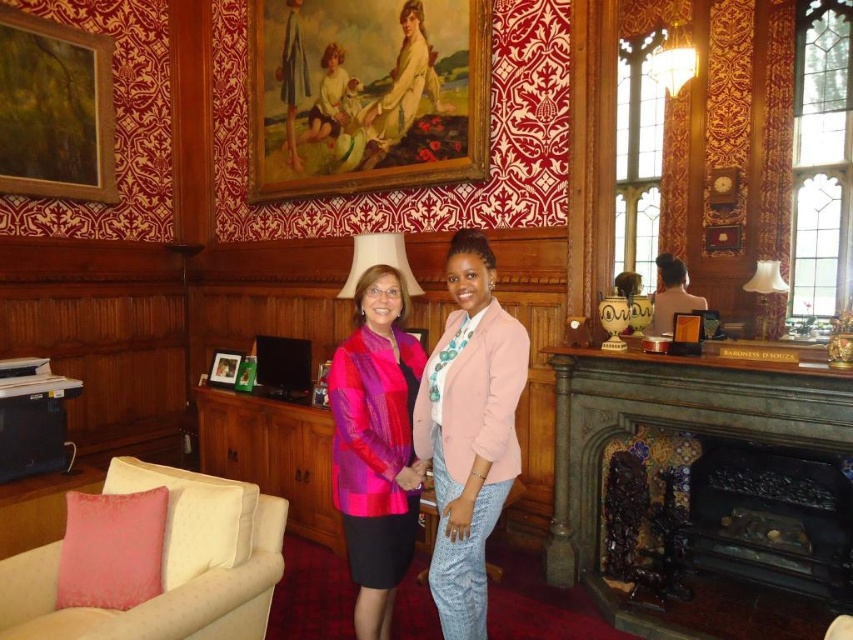
Question: Which of the following is the closest to the observer?

Choices:
 (A) (663, 77)
 (B) (364, 472)

Answer: (B)

Question: From the image, what is the correct spatial relationship of velvet beige armchair at lower left in relation to wooden picture frame at center?

Choices:
 (A) left
 (B) right

Answer: (B)

Question: Which is nearer to the wooden framed painting at upper center?

Choices:
 (A) wooden picture frame at center
 (B) pink woven sweater at center
 (C) white fabric lampshade at upper center

Answer: (C)

Question: Among these objects, which one is farthest from the camera?

Choices:
 (A) white fabric lampshade at upper center
 (B) wooden picture frame at center
 (C) white fabric lampshade at upper right

Answer: (B)

Question: Does pink fabric jacket at center have a greater width compared to pink fabric picture frame at center?

Choices:
 (A) no
 (B) yes

Answer: (B)

Question: Does white fabric lampshade at upper center have a greater width compared to pink fabric picture frame at center?

Choices:
 (A) yes
 (B) no

Answer: (A)